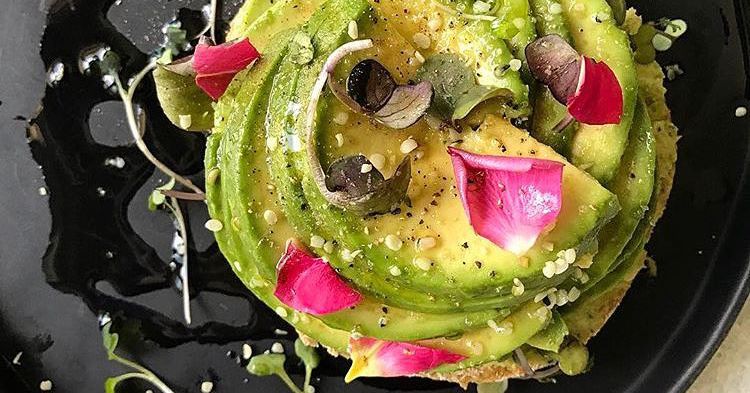
Where is `rim of plate`? This screenshot has width=750, height=393. rim of plate is located at coordinates (722, 326).